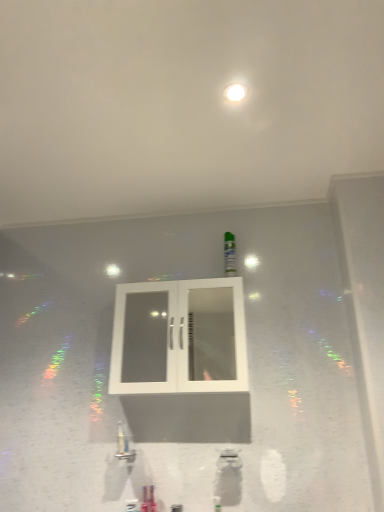
Describe the element at coordinates (176, 338) in the screenshot. I see `white glass cabinet at center` at that location.

The height and width of the screenshot is (512, 384). I want to click on green matte bottle at center, so click(x=229, y=254).

Is point (239, 281) closer or farther from the camera than point (161, 4)?

Point (239, 281) is farther from the camera than point (161, 4).

Is white glass cabinet at center smaller than white matte ceiling at upper center?

Correct, white glass cabinet at center occupies less space than white matte ceiling at upper center.

Who is shorter, white glass cabinet at center or white matte ceiling at upper center?

white matte ceiling at upper center is shorter.

Is white glass cabinet at center oriented away from white matte ceiling at upper center?

white glass cabinet at center is not turned away from white matte ceiling at upper center.

From the image's perspective, which one is positioned lower, green matte bottle at center or white matte ceiling at upper center?

green matte bottle at center.

This screenshot has width=384, height=512. What are the coordinates of `bottle directly beneath the white matte ceiling at upper center (from a real-world perspective)` in the screenshot? It's located at (229, 254).

Between green matte bottle at center and white matte ceiling at upper center, which one has larger size?

white matte ceiling at upper center is bigger.

Between green matte bottle at center and white matte ceiling at upper center, which one has smaller width?

green matte bottle at center is thinner.

Image resolution: width=384 pixels, height=512 pixels. In the image, there is a green matte bottle at center. Find the location of `window below it (from the image's perspective)`. window below it (from the image's perspective) is located at coordinates (176, 338).

Can green matte bottle at center be found inside white glass cabinet at center?

Definitely not — green matte bottle at center is not inside white glass cabinet at center.

From a real-world perspective, is white glass cabinet at center above or below green matte bottle at center?

In terms of real-world spatial position, white glass cabinet at center is below green matte bottle at center.

Would you consider white glass cabinet at center to be distant from green matte bottle at center?

They are positioned close to each other.

Which of these two, white matte ceiling at upper center or green matte bottle at center, stands taller?

With more height is green matte bottle at center.

Considering the relative sizes of white matte ceiling at upper center and green matte bottle at center in the image provided, is white matte ceiling at upper center thinner than green matte bottle at center?

No.

From a real-world perspective, is white matte ceiling at upper center below green matte bottle at center?

Incorrect, from a real-world perspective, white matte ceiling at upper center is higher than green matte bottle at center.

The image size is (384, 512). In order to click on bottle behind the white matte ceiling at upper center in this screenshot , I will do `click(229, 254)`.

From a real-world perspective, does white matte ceiling at upper center sit lower than white glass cabinet at center?

Incorrect, from a real-world perspective, white matte ceiling at upper center is higher than white glass cabinet at center.

Considering the relative sizes of white matte ceiling at upper center and white glass cabinet at center in the image provided, is white matte ceiling at upper center shorter than white glass cabinet at center?

Yes.

Considering the sizes of objects white matte ceiling at upper center and white glass cabinet at center in the image provided, who is bigger, white matte ceiling at upper center or white glass cabinet at center?

white matte ceiling at upper center.

Which object is closer to the camera taking this photo, white matte ceiling at upper center or white glass cabinet at center?

white matte ceiling at upper center.

What are the coordinates of `bottle behind the white glass cabinet at center` in the screenshot? It's located at (229, 254).

Consider the image. Is green matte bottle at center placed right next to white glass cabinet at center?

There is a gap between green matte bottle at center and white glass cabinet at center.

Between green matte bottle at center and white glass cabinet at center, which one appears on the right side from the viewer's perspective?

green matte bottle at center.

Where is `backdrop in front of the white glass cabinet at center`? The height and width of the screenshot is (512, 384). backdrop in front of the white glass cabinet at center is located at coordinates (184, 104).

At what (x,y) coordinates should I click in order to perform the action: click on bottle behind the white matte ceiling at upper center. Please return your answer as a coordinate pair (x, y). Looking at the image, I should click on (229, 254).

Looking at the image, which one is located closer to white glass cabinet at center, green matte bottle at center or white matte ceiling at upper center?

green matte bottle at center lies closer to white glass cabinet at center than the other object.

Considering their positions, is white glass cabinet at center positioned closer to green matte bottle at center than white matte ceiling at upper center?

Based on the image, white glass cabinet at center appears to be nearer to green matte bottle at center.

Based on their spatial positions, is white matte ceiling at upper center or green matte bottle at center closer to white glass cabinet at center?

green matte bottle at center is closer to white glass cabinet at center.

Which object lies nearer to the anchor point green matte bottle at center, white matte ceiling at upper center or white glass cabinet at center?

white glass cabinet at center is positioned closer to the anchor green matte bottle at center.

Which object lies nearer to the anchor point white matte ceiling at upper center, green matte bottle at center or white glass cabinet at center?

green matte bottle at center is positioned closer to the anchor white matte ceiling at upper center.

Considering their positions, is white glass cabinet at center positioned further to white matte ceiling at upper center than green matte bottle at center?

white glass cabinet at center.

Where is `window positioned between white matte ceiling at upper center and green matte bottle at center from near to far`? The width and height of the screenshot is (384, 512). window positioned between white matte ceiling at upper center and green matte bottle at center from near to far is located at coordinates (176, 338).